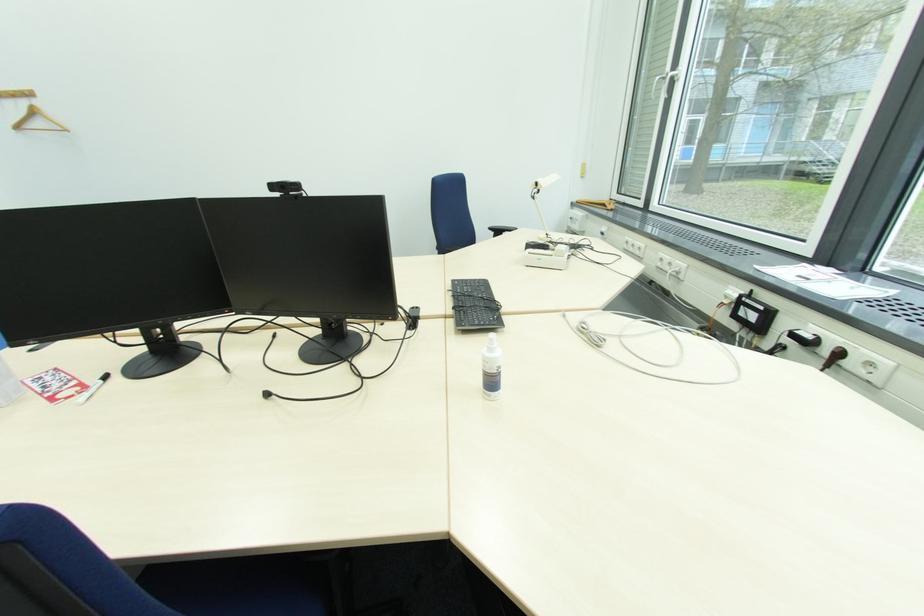
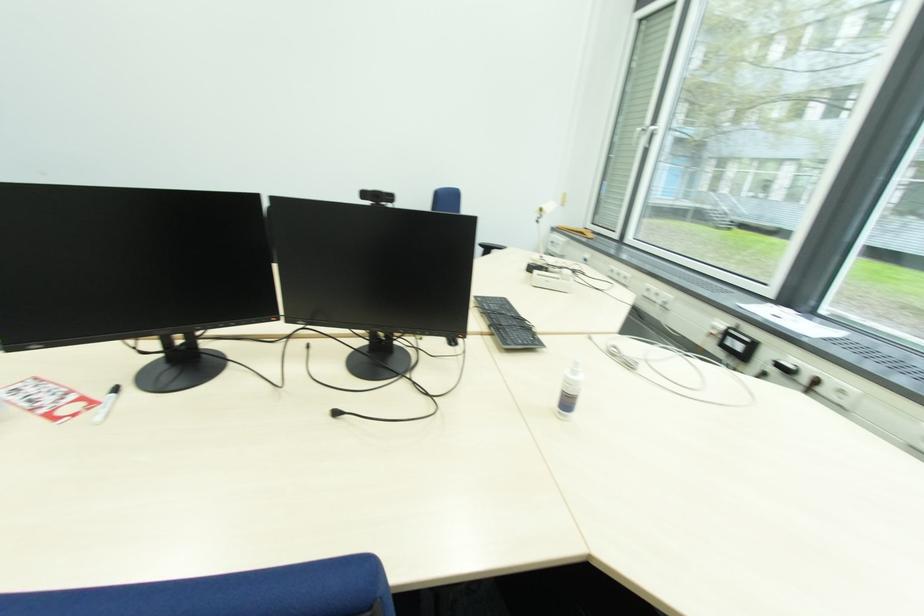
Question: In a continuous first-person perspective shot, in which direction is the camera moving?

Choices:
 (A) Left
 (B) Right
 (C) Forward
 (D) Backward

Answer: (A)